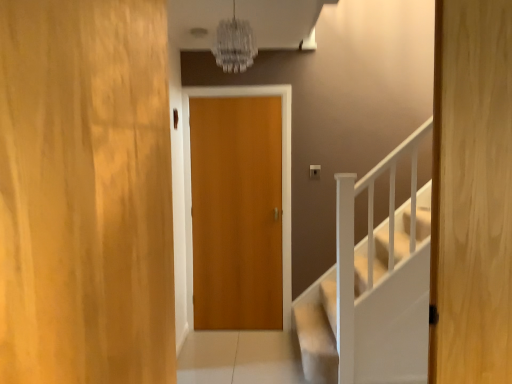
Question: Is the position of wooden door at center, positioned as the 1th door in front-to-back order, more distant than that of wooden door at center, which is the first door in back-to-front order?

Choices:
 (A) no
 (B) yes

Answer: (A)

Question: Is wooden door at center, arranged as the 1th door when viewed from the left, taller than wooden door at center, which is the first door in back-to-front order?

Choices:
 (A) yes
 (B) no

Answer: (B)

Question: Is wooden door at center, marked as the 3th door in a back-to-front arrangement, touching wooden door at center, marked as the 2th door in a left-to-right arrangement?

Choices:
 (A) no
 (B) yes

Answer: (A)

Question: From a real-world perspective, does wooden door at center, marked as the 3th door in a back-to-front arrangement, sit lower than wooden door at center, the third door from the front?

Choices:
 (A) no
 (B) yes

Answer: (A)

Question: Is wooden door at center, arranged as the 1th door when viewed from the left, completely or partially outside of wooden door at center, the third door from the front?

Choices:
 (A) no
 (B) yes

Answer: (B)

Question: Does point (442, 336) appear closer or farther from the camera than point (1, 231)?

Choices:
 (A) closer
 (B) farther

Answer: (B)

Question: Is wooden door at center, the 3th door in the left-to-right sequence, inside or outside of wooden door at center, which is the third door in right-to-left order?

Choices:
 (A) inside
 (B) outside

Answer: (B)

Question: In the image, is wooden door at center, the 3th door in the left-to-right sequence, on the left side or the right side of wooden door at center, marked as the 3th door in a back-to-front arrangement?

Choices:
 (A) right
 (B) left

Answer: (A)

Question: From the image's perspective, is wooden door at center, which is the 1th door from right to left, above or below wooden door at center, arranged as the 1th door when viewed from the left?

Choices:
 (A) above
 (B) below

Answer: (A)

Question: Does point (276, 148) appear closer or farther from the camera than point (501, 71)?

Choices:
 (A) closer
 (B) farther

Answer: (B)

Question: From a real-world perspective, is wooden door at center, the second door in the right-to-left sequence, physically located above or below wooden door at center, the 3th door in the left-to-right sequence?

Choices:
 (A) above
 (B) below

Answer: (B)

Question: In terms of width, does wooden door at center, which is the first door in back-to-front order, look wider or thinner when compared to wooden door at center, which is the 1th door from right to left?

Choices:
 (A) wide
 (B) thin

Answer: (A)

Question: From the image's perspective, is wooden door at center, the third door from the front, above or below wooden door at center, which is the 1th door from right to left?

Choices:
 (A) below
 (B) above

Answer: (A)

Question: Considering the positions of wooden door at center, the second door viewed from the back, and wooden door at center, marked as the 2th door in a left-to-right arrangement, in the image, is wooden door at center, the second door viewed from the back, taller or shorter than wooden door at center, marked as the 2th door in a left-to-right arrangement,?

Choices:
 (A) tall
 (B) short

Answer: (B)

Question: Considering the relative positions of wooden door at center, the 3th door in the left-to-right sequence, and wooden door at center, marked as the 2th door in a left-to-right arrangement, in the image provided, is wooden door at center, the 3th door in the left-to-right sequence, to the left or to the right of wooden door at center, marked as the 2th door in a left-to-right arrangement,?

Choices:
 (A) left
 (B) right

Answer: (B)